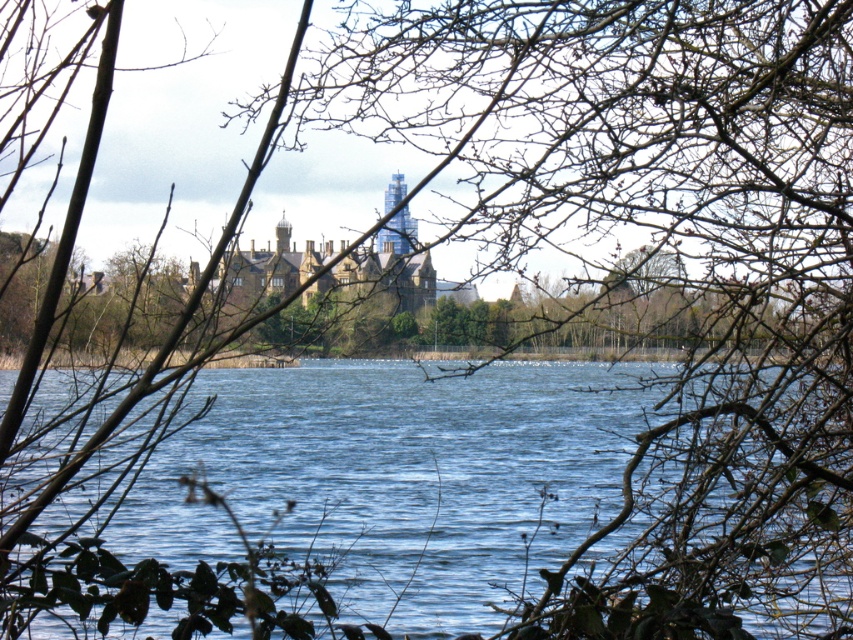
Question: Is brown leafless branches at center bigger than blue water at center?

Choices:
 (A) yes
 (B) no

Answer: (A)

Question: Which point is farther to the camera?

Choices:
 (A) (604, 451)
 (B) (792, 163)

Answer: (A)

Question: Which point is closer to the camera?

Choices:
 (A) blue water at center
 (B) brown leafless branches at center

Answer: (B)

Question: Does brown leafless branches at center lie in front of blue water at center?

Choices:
 (A) yes
 (B) no

Answer: (A)

Question: Which object appears farthest from the camera in this image?

Choices:
 (A) brown leafless branches at center
 (B) blue water at center

Answer: (B)

Question: Is brown leafless branches at center bigger than blue water at center?

Choices:
 (A) yes
 (B) no

Answer: (A)